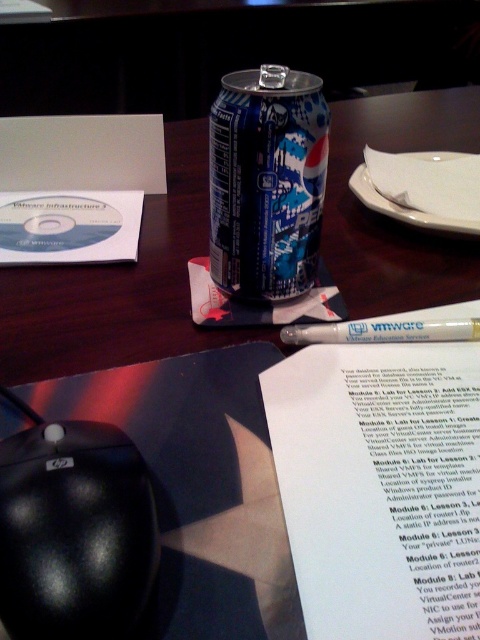
Between black matte mouse at lower left and white matte pen at center, which one is positioned higher?

white matte pen at center is above.

Is black matte mouse at lower left taller than white matte pen at center?

Yes.

Between point (62, 435) and point (295, 337), which one is positioned in front?

Point (62, 435)

The image size is (480, 640). I want to click on black matte mouse at lower left, so click(74, 532).

Can you confirm if black matte mouse at lower left is positioned to the left of blue metallic pepsi can at center?

Yes, black matte mouse at lower left is to the left of blue metallic pepsi can at center.

Does black matte mouse at lower left appear over blue metallic pepsi can at center?

No.

What are the coordinates of `black matte mouse at lower left` in the screenshot? It's located at (74, 532).

In order to click on black matte mouse at lower left in this screenshot , I will do click(74, 532).

Does blue metallic pepsi can at center appear under white matte pen at center?

No.

From the picture: Is blue metallic pepsi can at center wider than white matte pen at center?

No, blue metallic pepsi can at center is not wider than white matte pen at center.

Find the location of a particular element. blue metallic pepsi can at center is located at coordinates (266, 180).

Find the location of a particular element. The height and width of the screenshot is (640, 480). blue metallic pepsi can at center is located at coordinates (266, 180).